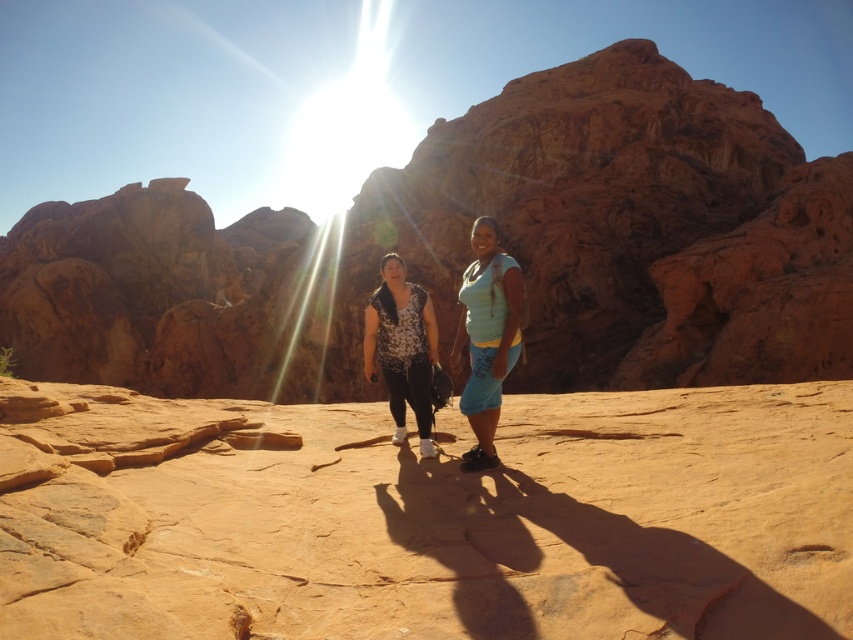
You are planning to take a photo of the rustic sandstone rock formation at center while standing on the flat, reddishbrown rock surface. Based on your current position, will the bright sun create a lens flare that might interfere with the photo?

The rustic sandstone rock formation at center is located at point (466, 252), so if the sun is in that direction, it could cause lens flare. Check the position of the sun relative to the rock formation to avoid glare.

You are a photographer planning to take a group photo of the two hikers wearing the matte floral shirt at center and the matte teal shirt at center. Since the sunlight is causing a lens flare, you want to position them so that the shorter person is in front to avoid the glare. Which hiker should stand in front?

The matte floral shirt at center is shorter than the matte teal shirt at center, so the hiker wearing the matte floral shirt at center should stand in front to avoid the lens flare glare.